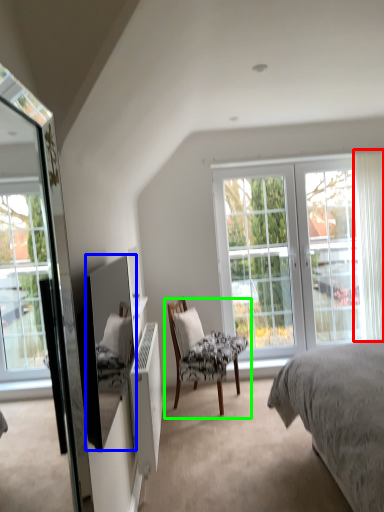
Question: Based on their relative distances, which object is farther from curtain (highlighted by a red box)? Choose from mirror (highlighted by a blue box) and chair (highlighted by a green box).

Choices:
 (A) mirror
 (B) chair

Answer: (A)